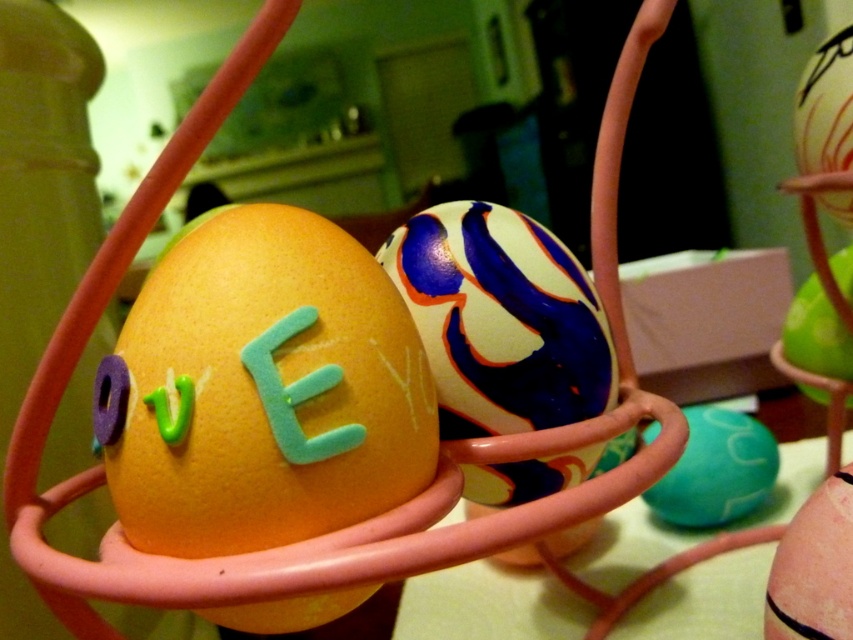
Question: Among these objects, which one is farthest from the camera?

Choices:
 (A) orange matte egg at center
 (B) marbled paper egg at center
 (C) matte teal egg at center
 (D) matte pink egg at center

Answer: (C)

Question: Which point is closer to the camera?

Choices:
 (A) matte pink egg at center
 (B) marbled paper egg at center
 (C) orange matte egg at center

Answer: (C)

Question: Based on their relative distances, which object is nearer to the green matte egg at center?

Choices:
 (A) matte pink egg at center
 (B) orange matte egg at center
 (C) marbled paper egg at center
 (D) matte teal egg at center

Answer: (D)

Question: In this image, where is marbled paper egg at center located relative to green matte egg at center?

Choices:
 (A) right
 (B) left

Answer: (B)

Question: Does orange matte egg at center lie behind green matte egg at center?

Choices:
 (A) yes
 (B) no

Answer: (B)

Question: Does marbled paper egg at center appear over matte pink egg at center?

Choices:
 (A) no
 (B) yes

Answer: (B)